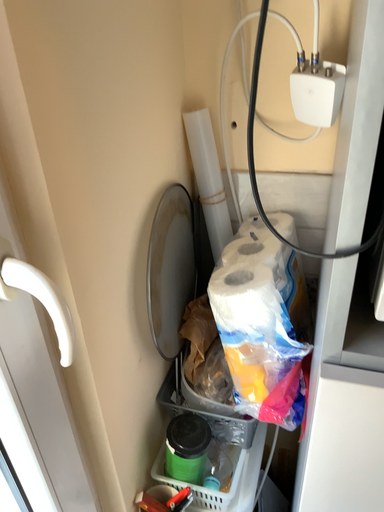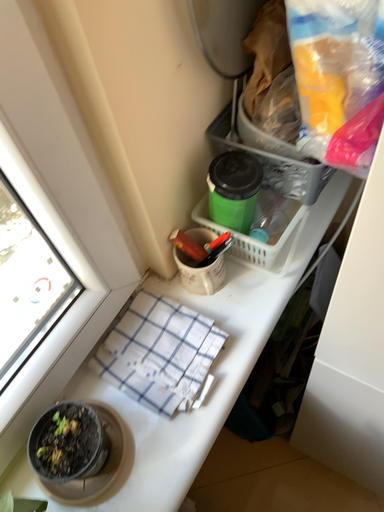
Question: Which way did the camera rotate in the video?

Choices:
 (A) rotated right
 (B) rotated left

Answer: (B)